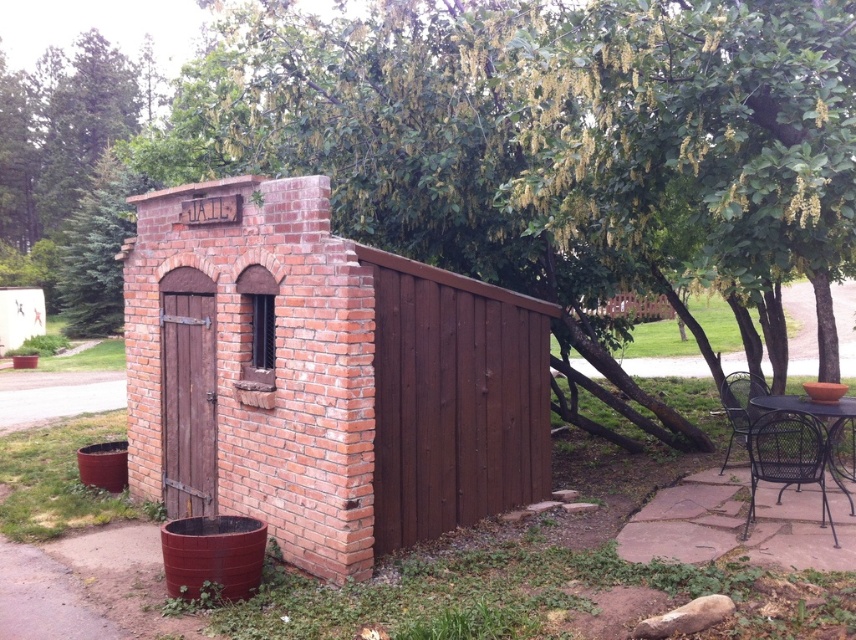
Can you confirm if rustic wicker chair at lower right is thinner than black wicker table at lower right?

Correct, rustic wicker chair at lower right's width is less than black wicker table at lower right's.

Between rustic wicker chair at lower right and black wicker table at lower right, which one appears on the left side from the viewer's perspective?

From the viewer's perspective, rustic wicker chair at lower right appears more on the left side.

This screenshot has width=856, height=640. Find the location of `rustic wicker chair at lower right`. rustic wicker chair at lower right is located at coordinates (740, 404).

I want to click on rustic wicker chair at lower right, so (740, 404).

Does brick textured hut at center appear under rustic wicker chair at lower right?

Actually, brick textured hut at center is above rustic wicker chair at lower right.

Where is `brick textured hut at center`? This screenshot has width=856, height=640. brick textured hut at center is located at coordinates (322, 376).

Which is behind, point (322, 211) or point (736, 428)?

The point (736, 428) is more distant.

Identify the location of brick textured hut at center. This screenshot has width=856, height=640. (322, 376).

Can you confirm if brick textured hut at center is positioned to the left of black wicker table at lower right?

Correct, you'll find brick textured hut at center to the left of black wicker table at lower right.

Is brick textured hut at center bigger than black wicker table at lower right?

Yes, brick textured hut at center is bigger than black wicker table at lower right.

The width and height of the screenshot is (856, 640). I want to click on brick textured hut at center, so click(x=322, y=376).